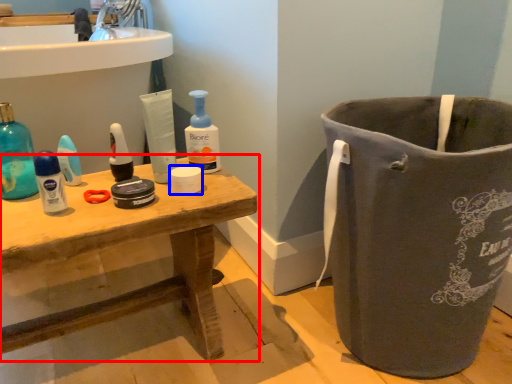
Question: Which object is closer to the camera taking this photo, table (highlighted by a red box) or toilet paper (highlighted by a blue box)?

Choices:
 (A) table
 (B) toilet paper

Answer: (A)